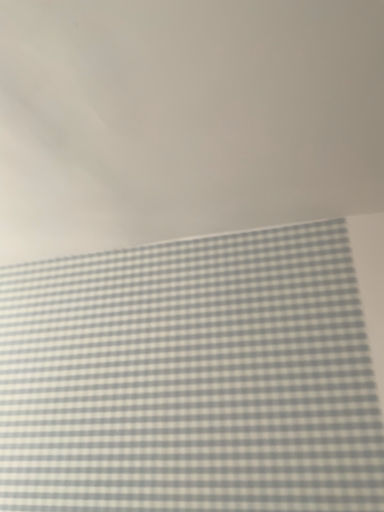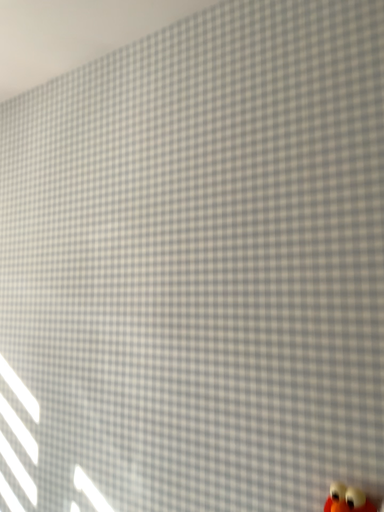
Question: Which way did the camera rotate in the video?

Choices:
 (A) rotated left
 (B) rotated right

Answer: (A)